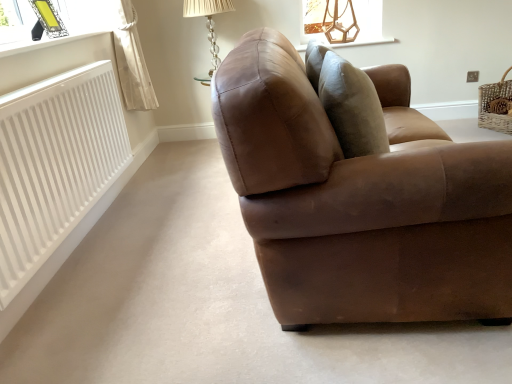
Question: Does translucent glass table lamp at upper center turn towards white smooth radiator at left?

Choices:
 (A) no
 (B) yes

Answer: (B)

Question: From a real-world perspective, is translucent glass table lamp at upper center physically above white smooth radiator at left?

Choices:
 (A) yes
 (B) no

Answer: (A)

Question: Would you say translucent glass table lamp at upper center is a long distance from white smooth radiator at left?

Choices:
 (A) no
 (B) yes

Answer: (B)

Question: Considering the relative positions of translucent glass table lamp at upper center and white smooth radiator at left in the image provided, is translucent glass table lamp at upper center to the right of white smooth radiator at left from the viewer's perspective?

Choices:
 (A) no
 (B) yes

Answer: (B)

Question: Can we say translucent glass table lamp at upper center lies outside white smooth radiator at left?

Choices:
 (A) no
 (B) yes

Answer: (B)

Question: Is translucent glass table lamp at upper center in front of or behind brown leather couch at center in the image?

Choices:
 (A) behind
 (B) front

Answer: (A)

Question: Does point (212, 28) appear closer or farther from the camera than point (243, 46)?

Choices:
 (A) closer
 (B) farther

Answer: (B)

Question: From a real-world perspective, is translucent glass table lamp at upper center physically located above or below brown leather couch at center?

Choices:
 (A) above
 (B) below

Answer: (A)

Question: In terms of width, does translucent glass table lamp at upper center look wider or thinner when compared to brown leather couch at center?

Choices:
 (A) wide
 (B) thin

Answer: (B)

Question: Is white smooth radiator at left inside the boundaries of white wicker basket at right, or outside?

Choices:
 (A) outside
 (B) inside

Answer: (A)

Question: Would you say white smooth radiator at left is to the left or to the right of white wicker basket at right in the picture?

Choices:
 (A) right
 (B) left

Answer: (B)

Question: From the image's perspective, is white smooth radiator at left above or below white wicker basket at right?

Choices:
 (A) above
 (B) below

Answer: (B)

Question: Is point (36, 198) closer or farther from the camera than point (510, 79)?

Choices:
 (A) closer
 (B) farther

Answer: (A)

Question: Is translucent glass table lamp at upper center wider or thinner than white smooth radiator at left?

Choices:
 (A) thin
 (B) wide

Answer: (B)

Question: Is point (216, 64) positioned closer to the camera than point (73, 206)?

Choices:
 (A) farther
 (B) closer

Answer: (A)